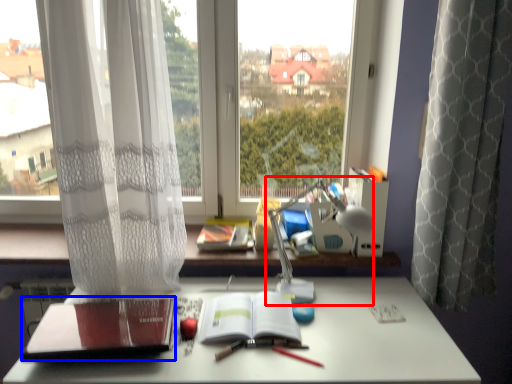
Question: Among these objects, which one is farthest to the camera, table lamp (highlighted by a red box) or paperback book (highlighted by a blue box)?

Choices:
 (A) table lamp
 (B) paperback book

Answer: (A)